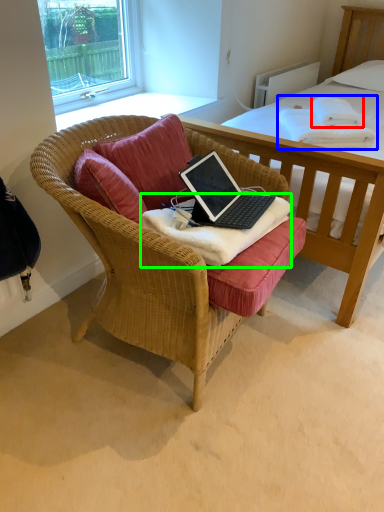
Question: Considering the real-world distances, which object is farthest from cloth (highlighted by a red box)? blanket (highlighted by a blue box) or blanket (highlighted by a green box)?

Choices:
 (A) blanket
 (B) blanket

Answer: (B)